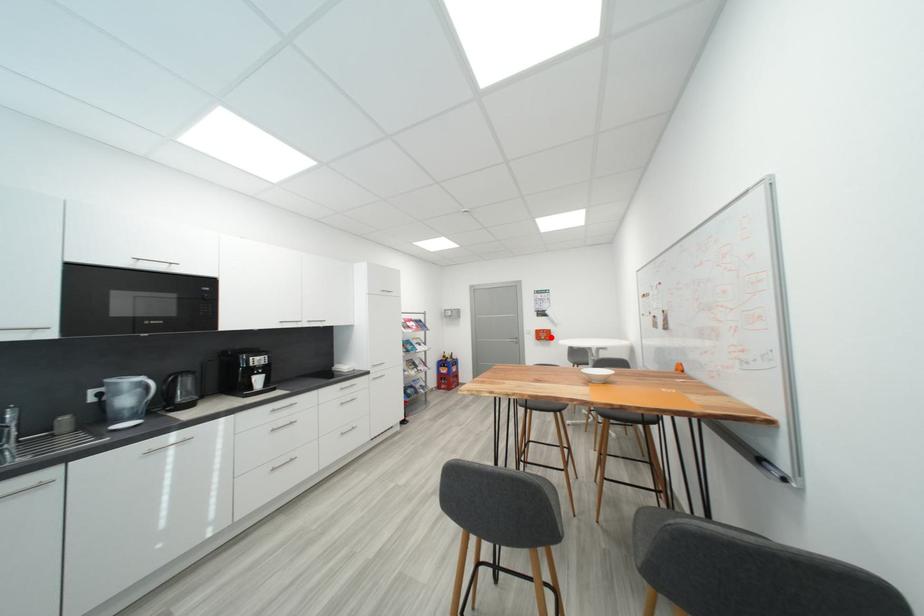
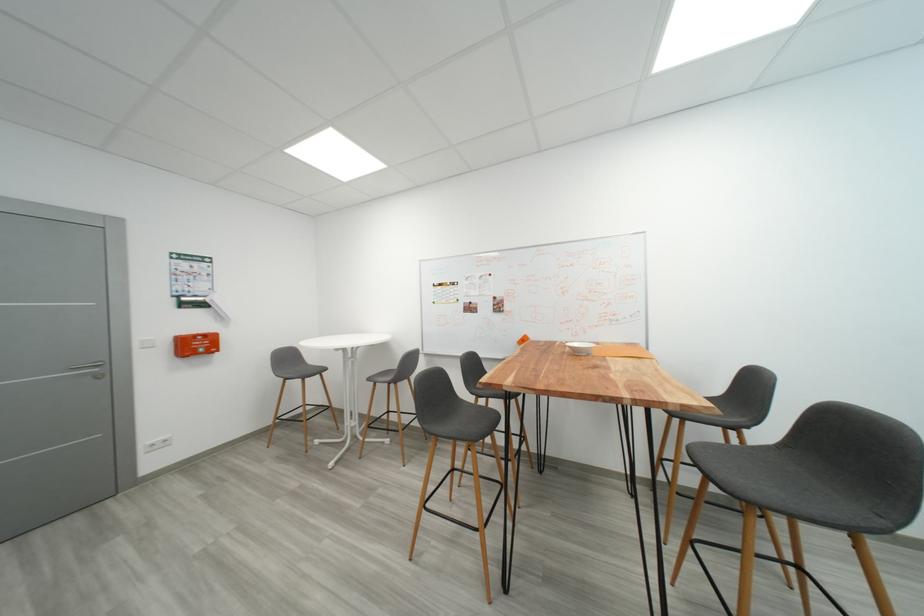
Where in the second image is the point corresponding to the highlighted location from the first image?

(203, 347)